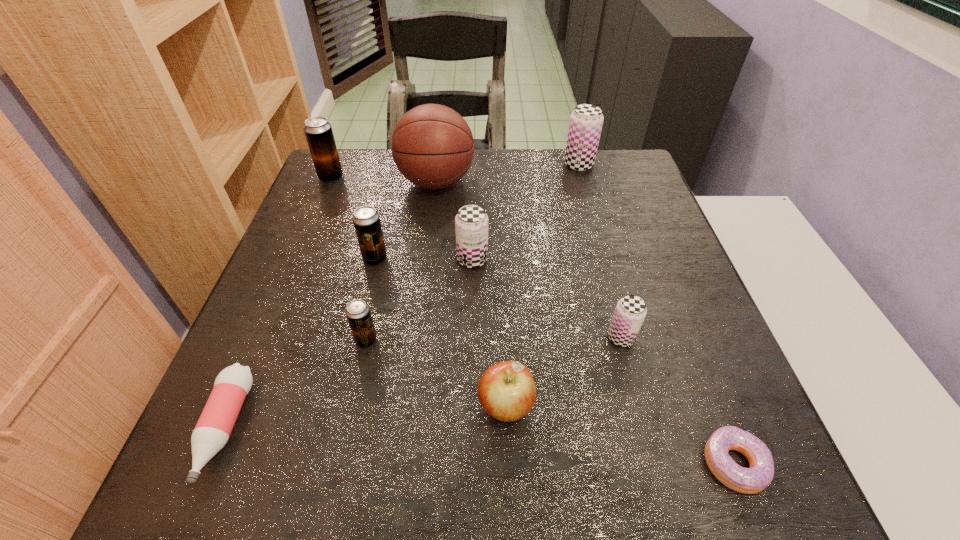
Identify the location of vacant region located 0.140m on the right of the nearest black beer can. The height and width of the screenshot is (540, 960). (450, 340).

The image size is (960, 540). Identify the location of free space located on the right of the apple. (598, 406).

Locate an element on the screen. vacant space located on the left of the doughnut is located at coordinates (652, 463).

At what (x,y) coordinates should I click in order to perform the action: click on basketball present at the far edge. Please return your answer as a coordinate pair (x, y). The height and width of the screenshot is (540, 960). Looking at the image, I should click on (432, 145).

Locate an element on the screen. Image resolution: width=960 pixels, height=540 pixels. bottle that is at the near edge is located at coordinates (212, 431).

You are a GUI agent. You are given a task and a screenshot of the screen. Output one action in this format:
    pyautogui.click(x=<x>, y=<y>)
    Task: Click on the doughnut located in the near edge section of the desktop
    The width and height of the screenshot is (960, 540).
    Given the screenshot: What is the action you would take?
    pyautogui.click(x=751, y=480)

Identify the location of beer can located at the left edge. The width and height of the screenshot is (960, 540). (x=318, y=131).

The image size is (960, 540). What are the coordinates of `bottle at the left edge` in the screenshot? It's located at (212, 431).

At what (x,y) coordinates should I click in order to perform the action: click on doughnut present at the right edge. Please return your answer as a coordinate pair (x, y). Image resolution: width=960 pixels, height=540 pixels. Looking at the image, I should click on (751, 480).

Image resolution: width=960 pixels, height=540 pixels. I want to click on object at the far left corner, so click(x=318, y=131).